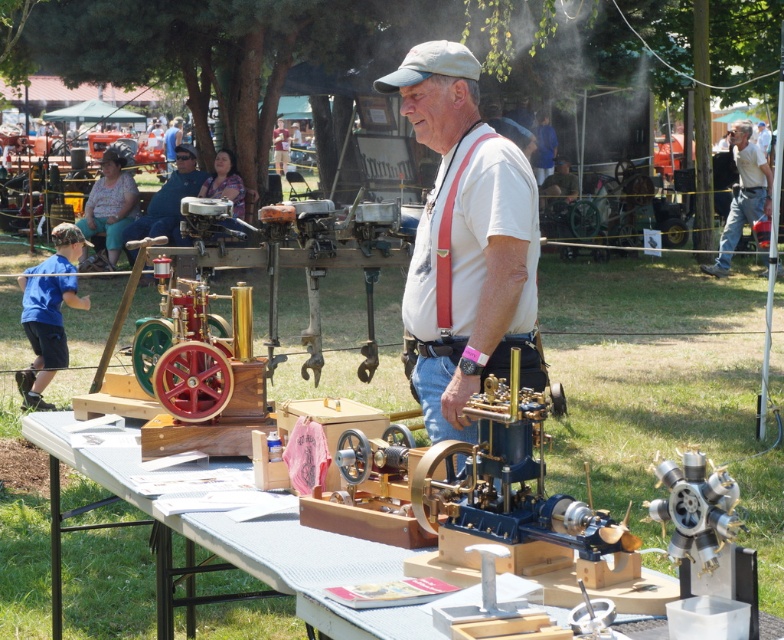
You are an observer at the vintage event and notice two items of clothing on a person in the scene. The items are the matte black shirt at upper center and the red fabric suspenders at center. Which clothing item is positioned higher on the person?

The matte black shirt at upper center is positioned higher on the person than the red fabric suspenders at center because the matte black shirt at upper center has a greater height compared to the red fabric suspenders at center.

You are a photographer at the event and want to capture a photo that includes both the white fabric table at center and the matte black shirt at upper center. Since you need to ensure both are fully visible, which object should you focus on first to account for their sizes?

The white fabric table at center is wider than the matte black shirt at upper center, so you should focus on the white fabric table at center first to ensure it fits in the frame properly before adjusting for the smaller matte black shirt at upper center.